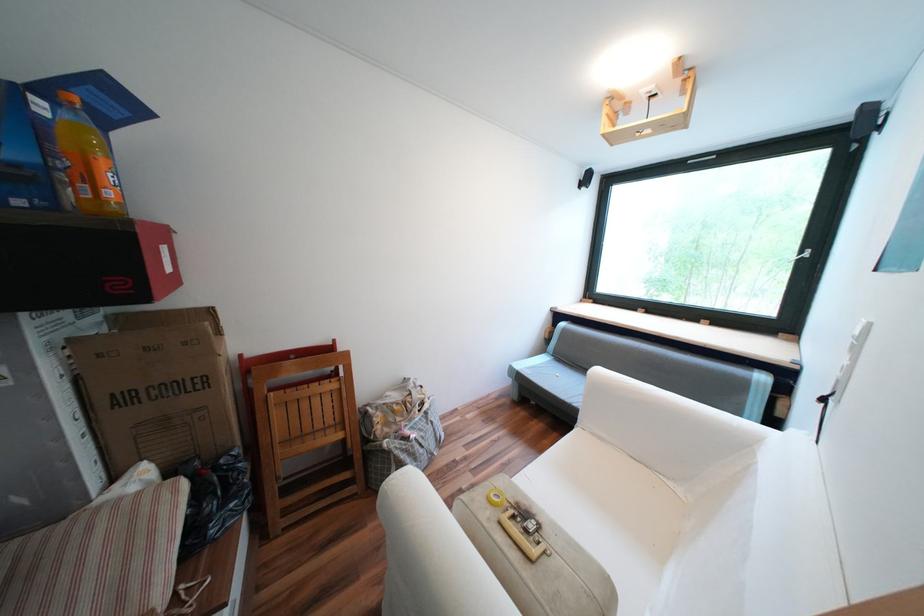
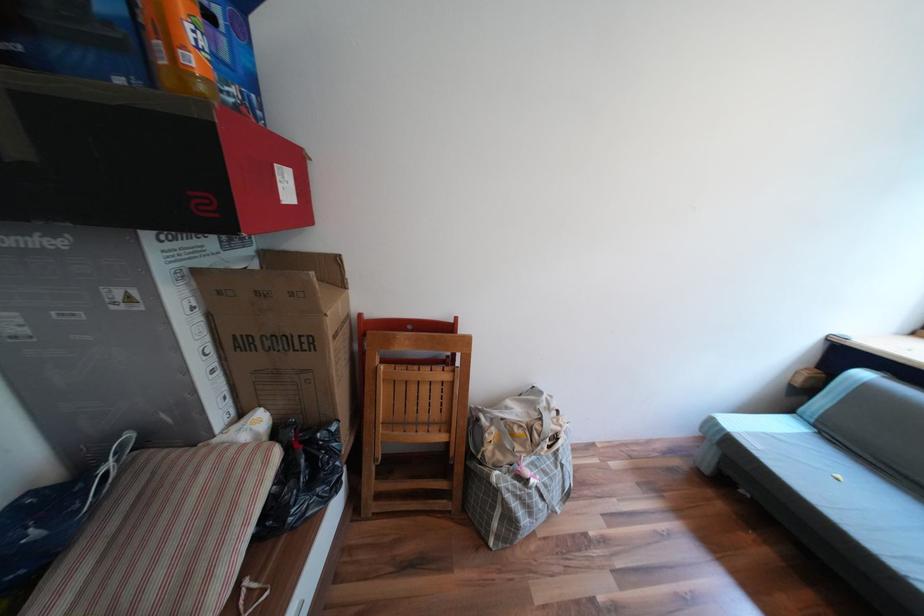
The point at (118, 193) is marked in the first image. Where is the corresponding point in the second image?

(201, 61)